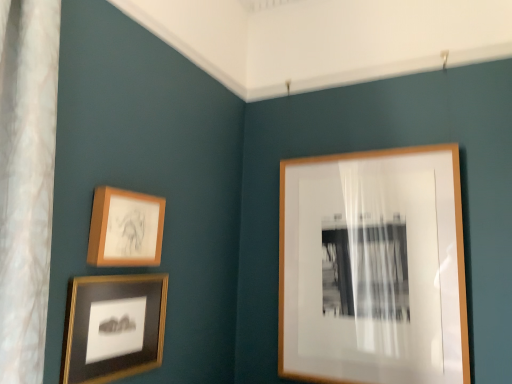
Question: Is point (403, 276) closer or farther from the camera than point (71, 321)?

Choices:
 (A) farther
 (B) closer

Answer: (A)

Question: Considering their positions, is wooden frame at upper right, which is the 1th picture frame from right to left, located in front of or behind matte black frame at lower left, arranged as the first picture frame when viewed from the left?

Choices:
 (A) front
 (B) behind

Answer: (B)

Question: Estimate the real-world distances between objects in this image. Which object is farther from the matte black frame at lower left, the 3th picture frame when ordered from right to left?

Choices:
 (A) wooden frame at upper right, which is the 1th picture frame from right to left
 (B) matte wooden picture frame at upper left, which appears as the second picture frame when viewed from the right

Answer: (A)

Question: Considering the real-world distances, which object is closest to the matte black frame at lower left, arranged as the first picture frame when viewed from the left?

Choices:
 (A) matte wooden picture frame at upper left, which ranks as the second picture frame in left-to-right order
 (B) wooden frame at upper right, the 3th picture frame positioned from the left

Answer: (A)